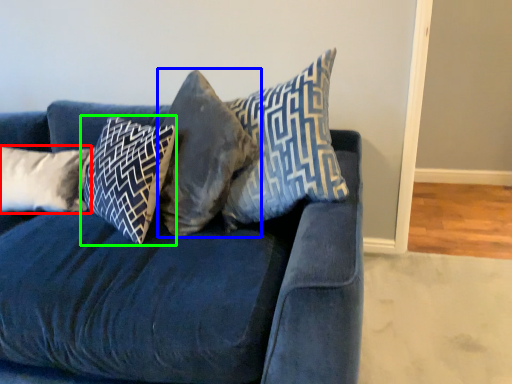
Question: Based on their relative distances, which object is nearer to pillow (highlighted by a red box)? Choose from pillow (highlighted by a blue box) and pillow (highlighted by a green box).

Choices:
 (A) pillow
 (B) pillow

Answer: (B)